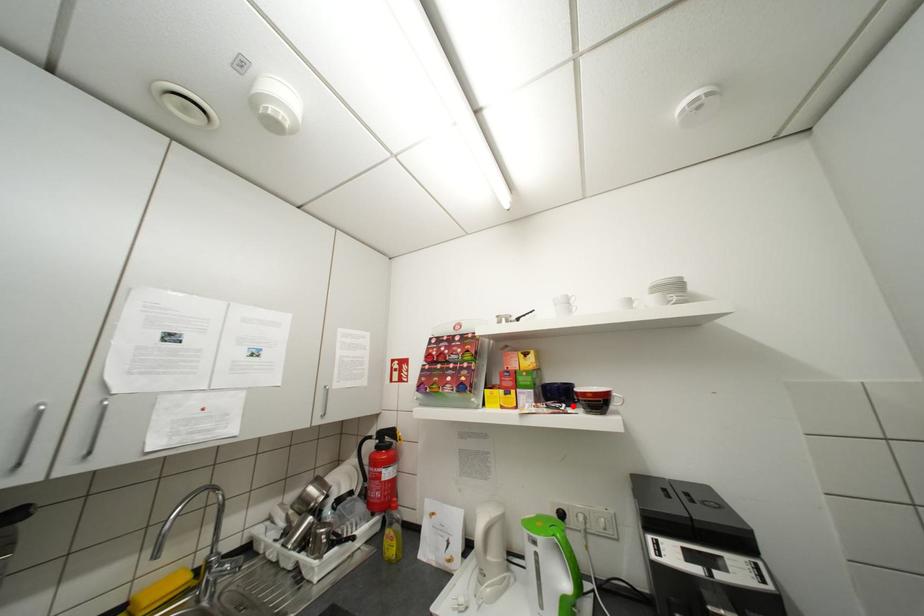
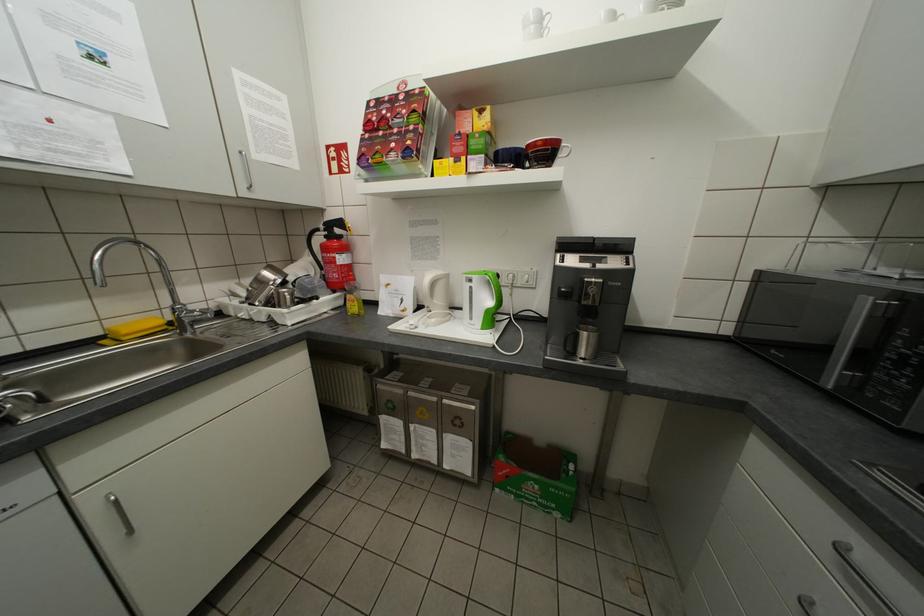
Find the pixel in the second image that matches the highlighted location in the first image.

(521, 166)